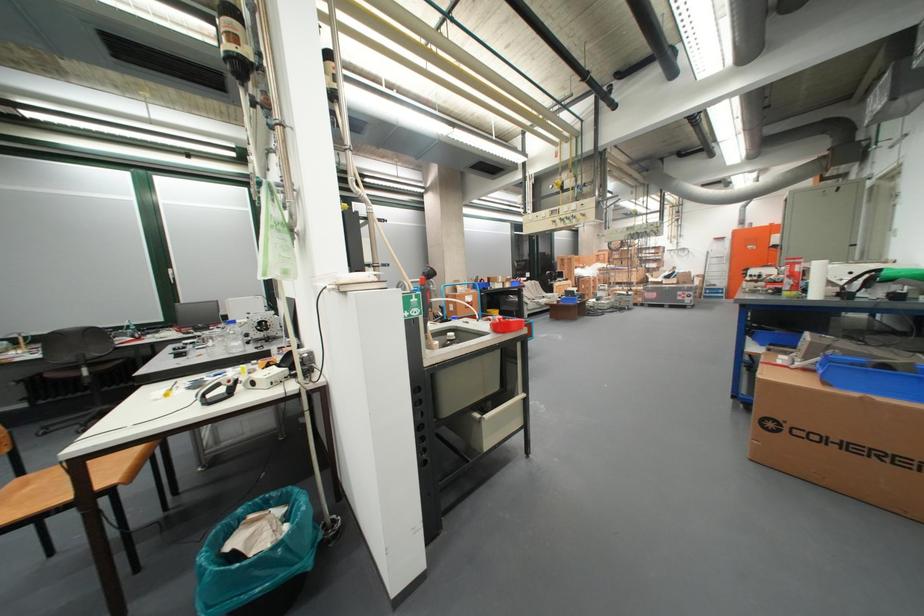
Where is `chair sitting surface`? The image size is (924, 616). chair sitting surface is located at coordinates (x=76, y=493).